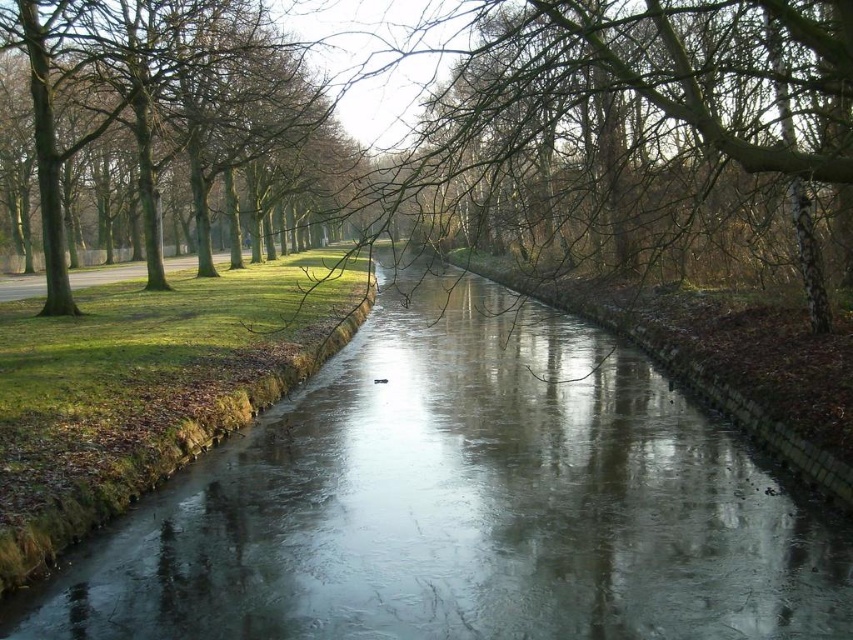
You are standing at the edge of the icy smooth river at center and want to look at the green leafy tree at upper left. Which direction should you turn your head to see it?

The green leafy tree at upper left is behind the icy smooth river at center, so you need to turn your head upward and backward to see it.